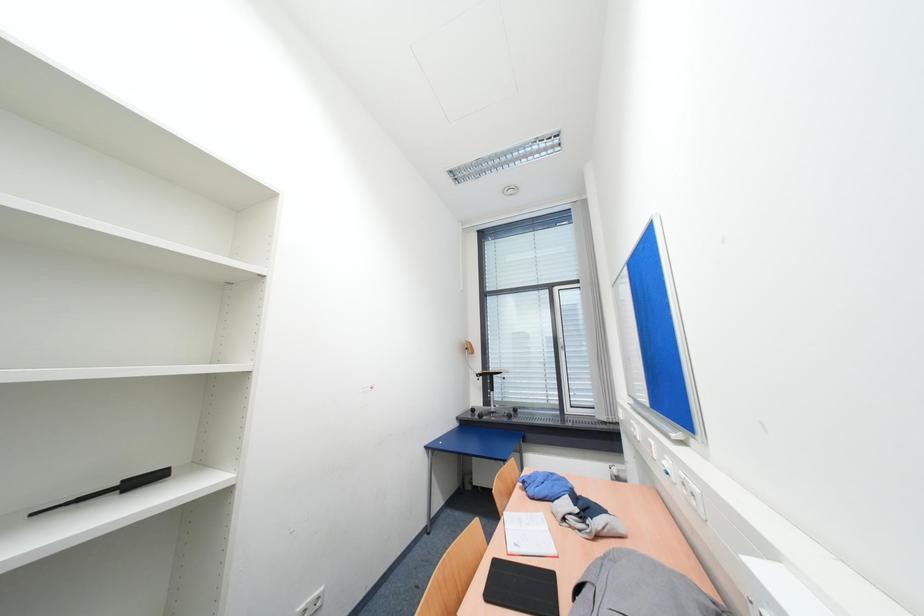
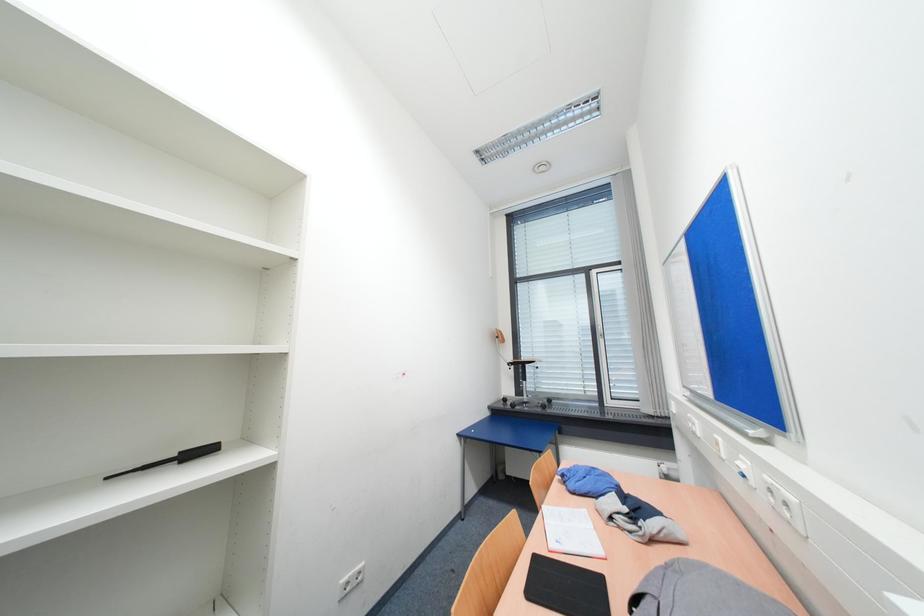
Question: The images are taken continuously from a first-person perspective. In which direction is your viewpoint rotating?

Choices:
 (A) Left
 (B) Right
 (C) Up
 (D) Down

Answer: (A)